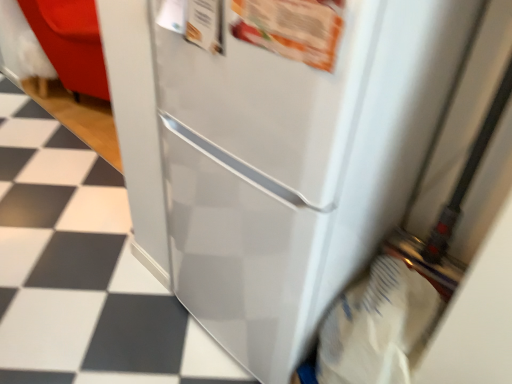
Identify the location of white glossy tile at lower left, positioned as the 2th tile in right-to-left order. This screenshot has width=512, height=384. (8, 86).

What are the coordinates of `white glossy tile at lower left, placed as the second tile when sorted from bottom to top` in the screenshot? It's located at (8, 86).

Is white paper grocery bag at lower right facing towards white glossy tile at lower left, positioned as the 2th tile in right-to-left order?

No, white paper grocery bag at lower right is not oriented towards white glossy tile at lower left, positioned as the 2th tile in right-to-left order.

Would you say white paper grocery bag at lower right is outside white glossy tile at lower left, positioned as the 2th tile in right-to-left order?

Absolutely, white paper grocery bag at lower right is external to white glossy tile at lower left, positioned as the 2th tile in right-to-left order.

Based on the photo, which is in front, white paper grocery bag at lower right or white glossy tile at lower left, the 2th tile viewed from the front?

white paper grocery bag at lower right is closer to the camera.

In order to click on the 2nd tile behind the white paper grocery bag at lower right in this screenshot , I will do `click(8, 86)`.

Which object is further away from the camera taking this photo, white glossy tile at lower left, the 1th tile in the bottom-to-top sequence, or white paper grocery bag at lower right?

white glossy tile at lower left, the 1th tile in the bottom-to-top sequence.

How different are the orientations of white glossy tile at lower left, the second tile positioned from the back, and white paper grocery bag at lower right in degrees?

The angular difference between white glossy tile at lower left, the second tile positioned from the back, and white paper grocery bag at lower right is 4.54 degrees.

In the scene shown: Is white glossy tile at lower left, arranged as the 1th tile when viewed from the back, to the left or to the right of white glossy tile at lower left, the second tile positioned from the back, in the image?

white glossy tile at lower left, arranged as the 1th tile when viewed from the back, is positioned on white glossy tile at lower left, the second tile positioned from the back,'s left side.

From the image's perspective, would you say white glossy tile at lower left, placed as the second tile when sorted from bottom to top, is shown under white glossy tile at lower left, the first tile positioned from the right?

No, from the image's perspective, white glossy tile at lower left, placed as the second tile when sorted from bottom to top, is not below white glossy tile at lower left, the first tile positioned from the right.

You are a GUI agent. You are given a task and a screenshot of the screen. Output one action in this format:
    pyautogui.click(x=<x>, y=<y>)
    Task: Click on the tile that appears above the white glossy tile at lower left, the second tile positioned from the back (from a real-world perspective)
    The width and height of the screenshot is (512, 384).
    Given the screenshot: What is the action you would take?
    point(8,86)

Which object is more forward, white glossy tile at lower left, acting as the first tile starting from the top, or white glossy tile at lower left, which ranks as the first tile in front-to-back order?

white glossy tile at lower left, which ranks as the first tile in front-to-back order, is closer to the camera.

Which of these two, white paper grocery bag at lower right or white glossy tile at lower left, which ranks as the first tile in front-to-back order, is smaller?

white glossy tile at lower left, which ranks as the first tile in front-to-back order, is smaller.

Is white paper grocery bag at lower right outside of white glossy tile at lower left, the second tile positioned from the back?

Yes.

Based on the photo, is white paper grocery bag at lower right taller than white glossy tile at lower left, acting as the 2th tile starting from the top?

Correct, white paper grocery bag at lower right is much taller as white glossy tile at lower left, acting as the 2th tile starting from the top.

Can you tell me how much white glossy tile at lower left, which ranks as the first tile in front-to-back order, and white glossy tile at lower left, arranged as the 1th tile when viewed from the back, differ in facing direction?

white glossy tile at lower left, which ranks as the first tile in front-to-back order, and white glossy tile at lower left, arranged as the 1th tile when viewed from the back, are facing 0.778 degrees away from each other.

Which of these two, white glossy tile at lower left, acting as the 2th tile starting from the top, or white glossy tile at lower left, positioned as the 2th tile in right-to-left order, is thinner?

white glossy tile at lower left, acting as the 2th tile starting from the top.

Does white glossy tile at lower left, the 1th tile in the bottom-to-top sequence, have a lesser height compared to white glossy tile at lower left, arranged as the 1th tile when viewed from the back?

Indeed, white glossy tile at lower left, the 1th tile in the bottom-to-top sequence, has a lesser height compared to white glossy tile at lower left, arranged as the 1th tile when viewed from the back.

Is white glossy tile at lower left, the 1th tile in the bottom-to-top sequence, positioned before white glossy tile at lower left, arranged as the 1th tile when viewed from the back?

Yes, the depth of white glossy tile at lower left, the 1th tile in the bottom-to-top sequence, is less than that of white glossy tile at lower left, arranged as the 1th tile when viewed from the back.

Is white glossy tile at lower left, acting as the first tile starting from the top, shorter than white paper grocery bag at lower right?

Yes, white glossy tile at lower left, acting as the first tile starting from the top, is shorter than white paper grocery bag at lower right.

Is white paper grocery bag at lower right surrounded by white glossy tile at lower left, arranged as the 1th tile when viewed from the back?

That's incorrect, white paper grocery bag at lower right is not inside white glossy tile at lower left, arranged as the 1th tile when viewed from the back.

Is white glossy tile at lower left, the 2th tile viewed from the front, touching white paper grocery bag at lower right?

No, white glossy tile at lower left, the 2th tile viewed from the front, is not with white paper grocery bag at lower right.

Between white glossy tile at lower left, acting as the first tile starting from the top, and white paper grocery bag at lower right, which one has larger size?

Bigger between the two is white paper grocery bag at lower right.

There is a white paper grocery bag at lower right. What are the coordinates of `the 1st tile below it (from a real-world perspective)` in the screenshot? It's located at (8, 86).

From the image's perspective, starting from the white paper grocery bag at lower right, which tile is the 1st one above? Please provide its 2D coordinates.

[(137, 274)]

Based on their spatial positions, is white glossy tile at lower left, arranged as the first tile when viewed from the left, or white paper grocery bag at lower right further from white glossy tile at lower left, arranged as the 2th tile when viewed from the left?

white glossy tile at lower left, arranged as the first tile when viewed from the left, is further to white glossy tile at lower left, arranged as the 2th tile when viewed from the left.

Looking at the image, which one is located closer to white glossy tile at lower left, placed as the second tile when sorted from bottom to top, white glossy tile at lower left, the first tile positioned from the right, or white paper grocery bag at lower right?

The object closer to white glossy tile at lower left, placed as the second tile when sorted from bottom to top, is white glossy tile at lower left, the first tile positioned from the right.

Considering their positions, is white glossy tile at lower left, arranged as the first tile when viewed from the left, positioned closer to white paper grocery bag at lower right than white glossy tile at lower left, the 1th tile in the bottom-to-top sequence?

white glossy tile at lower left, the 1th tile in the bottom-to-top sequence, is closer to white paper grocery bag at lower right.

From the image, which object appears to be nearer to white glossy tile at lower left, which ranks as the first tile in front-to-back order, white paper grocery bag at lower right or white glossy tile at lower left, acting as the first tile starting from the top?

white paper grocery bag at lower right lies closer to white glossy tile at lower left, which ranks as the first tile in front-to-back order, than the other object.

Based on their spatial positions, is white paper grocery bag at lower right or white glossy tile at lower left, the first tile positioned from the right, further from white glossy tile at lower left, arranged as the 1th tile when viewed from the back?

white paper grocery bag at lower right lies further to white glossy tile at lower left, arranged as the 1th tile when viewed from the back, than the other object.

When comparing their distances from white paper grocery bag at lower right, does white glossy tile at lower left, the 1th tile in the bottom-to-top sequence, or white glossy tile at lower left, acting as the first tile starting from the top, seem further?

The object further to white paper grocery bag at lower right is white glossy tile at lower left, acting as the first tile starting from the top.

Locate an element on the screen. The image size is (512, 384). tile located between white paper grocery bag at lower right and white glossy tile at lower left, placed as the second tile when sorted from bottom to top, in the depth direction is located at coordinates (137, 274).